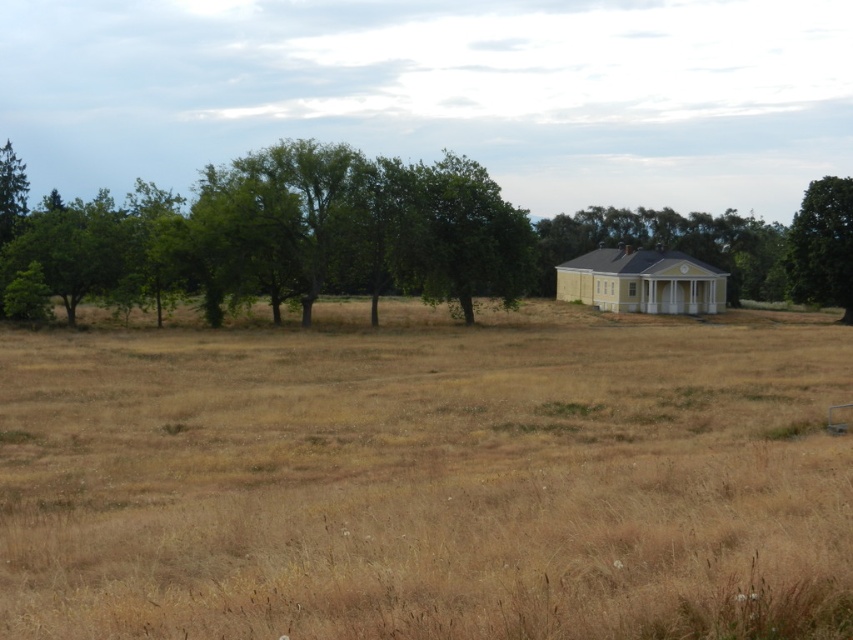
Can you confirm if yellow matte house at center is positioned above green leafy tree at right?

Correct, yellow matte house at center is located above green leafy tree at right.

Which is behind, point (596, 211) or point (820, 289)?

The point (596, 211) is behind.

Does point (642, 220) lie behind point (825, 278)?

That is True.

You are a GUI agent. You are given a task and a screenshot of the screen. Output one action in this format:
    pyautogui.click(x=<x>, y=<y>)
    Task: Click on the yellow matte house at center
    The width and height of the screenshot is (853, 640).
    Given the screenshot: What is the action you would take?
    pyautogui.click(x=671, y=244)

Looking at this image, who is taller, dry grass at center or green leafy tree at center?

Standing taller between the two is green leafy tree at center.

Can you confirm if dry grass at center is wider than green leafy tree at center?

Yes, dry grass at center is wider than green leafy tree at center.

Is point (723, 467) behind point (434, 202)?

No.

Locate an element on the screen. Image resolution: width=853 pixels, height=640 pixels. dry grass at center is located at coordinates (428, 477).

Is point (608, 564) positioned behind point (698, 260)?

No, it is not.

Does point (288, 396) lie in front of point (705, 304)?

That is True.

Image resolution: width=853 pixels, height=640 pixels. I want to click on dry grass at center, so click(428, 477).

Locate an element on the screen. The height and width of the screenshot is (640, 853). dry grass at center is located at coordinates (428, 477).